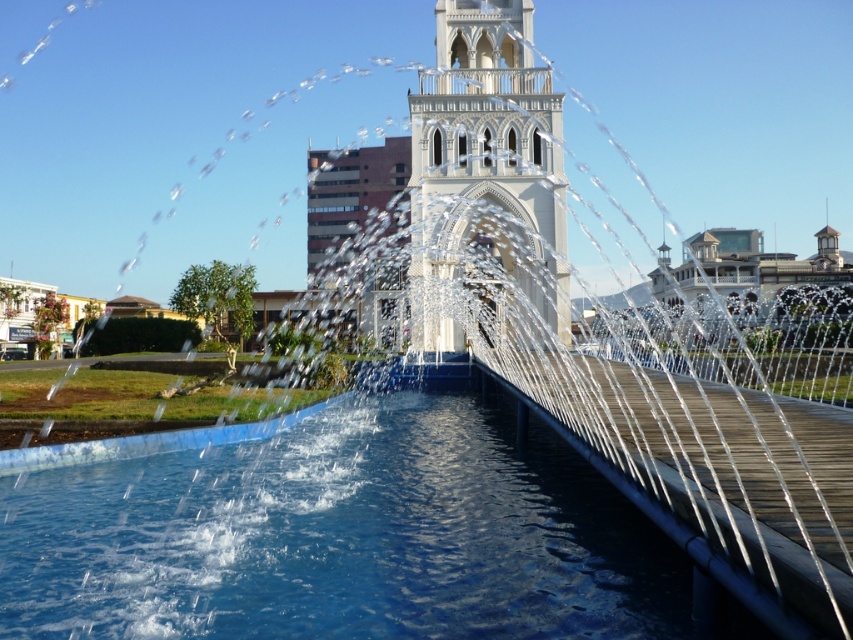
Question: Which object is closer to the camera taking this photo?

Choices:
 (A) white stone tower at center
 (B) transparent blue water at center

Answer: (B)

Question: Does transparent blue water at center appear over white stone tower at center?

Choices:
 (A) no
 (B) yes

Answer: (A)

Question: Does transparent blue water at center have a larger size compared to white stone tower at center?

Choices:
 (A) yes
 (B) no

Answer: (A)

Question: Is transparent blue water at center wider than white stone tower at center?

Choices:
 (A) no
 (B) yes

Answer: (B)